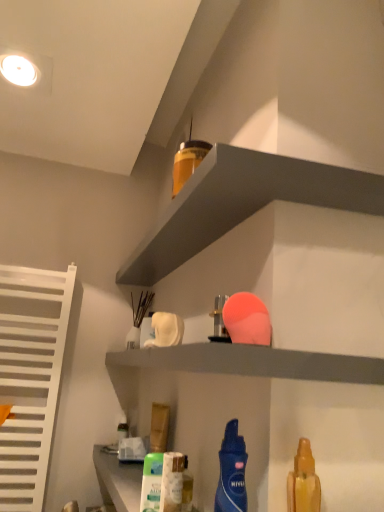
Question: Which direction should I rotate to face white matte shelf at upper center, marked as the 2th shelf in a top-to-bottom arrangement, — up or down?

Choices:
 (A) up
 (B) down

Answer: (B)

Question: Should I look upward or downward to see translucent plastic bottle at upper center, the third cleaning product positioned from the right?

Choices:
 (A) up
 (B) down

Answer: (A)

Question: Is blue matte lotion at center, which is the 3th cleaning product in bottom-to-top order, taller than white slatted radiator at left?

Choices:
 (A) yes
 (B) no

Answer: (B)

Question: Is blue matte lotion at center, the second cleaning product positioned from the top, shorter than white slatted radiator at left?

Choices:
 (A) yes
 (B) no

Answer: (A)

Question: Is blue matte lotion at center, the 3th cleaning product from the back, positioned in front of white slatted radiator at left?

Choices:
 (A) yes
 (B) no

Answer: (A)

Question: Is blue matte lotion at center, the second cleaning product positioned from the top, wider than white slatted radiator at left?

Choices:
 (A) yes
 (B) no

Answer: (B)

Question: Does blue matte lotion at center, which is counted as the 2th cleaning product, starting from the right, touch white slatted radiator at left?

Choices:
 (A) no
 (B) yes

Answer: (A)

Question: Does blue matte lotion at center, the second cleaning product positioned from the top, have a larger size compared to white slatted radiator at left?

Choices:
 (A) no
 (B) yes

Answer: (A)

Question: From a real-world perspective, is white slatted radiator at left positioned under white matte shelf at upper center, marked as the 2th shelf in a top-to-bottom arrangement, based on gravity?

Choices:
 (A) yes
 (B) no

Answer: (A)

Question: Is white slatted radiator at left completely or partially outside of white matte shelf at upper center, marked as the 2th shelf in a top-to-bottom arrangement?

Choices:
 (A) yes
 (B) no

Answer: (A)

Question: Can you confirm if white slatted radiator at left is wider than white matte shelf at upper center, the first shelf positioned from the bottom?

Choices:
 (A) yes
 (B) no

Answer: (B)

Question: Does white slatted radiator at left have a lesser height compared to white matte shelf at upper center, the first shelf positioned from the bottom?

Choices:
 (A) yes
 (B) no

Answer: (B)

Question: Is white slatted radiator at left touching white matte shelf at upper center, the first shelf positioned from the bottom?

Choices:
 (A) no
 (B) yes

Answer: (A)

Question: Does white slatted radiator at left appear on the right side of white matte shelf at upper center, marked as the 2th shelf in a top-to-bottom arrangement?

Choices:
 (A) yes
 (B) no

Answer: (B)

Question: Is matte gray shelf at upper center, positioned as the 2th shelf in bottom-to-top order, surrounded by white matte shelf at upper center, the first shelf positioned from the bottom?

Choices:
 (A) yes
 (B) no

Answer: (B)